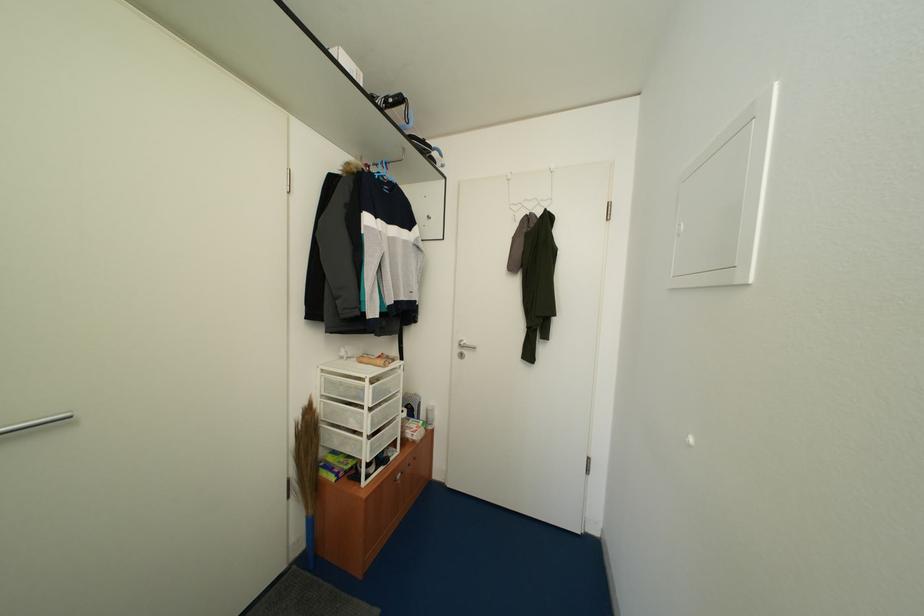
In order to click on silver door handle in this screenshot , I will do `click(35, 423)`.